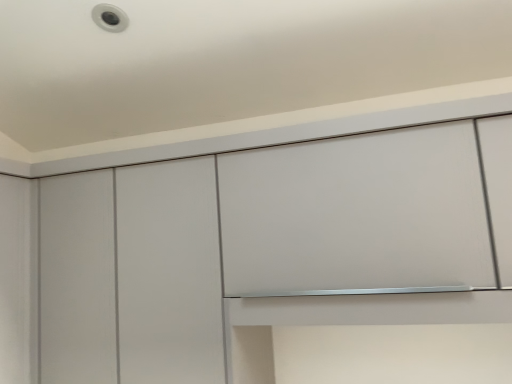
The width and height of the screenshot is (512, 384). What do you see at coordinates (273, 239) in the screenshot?
I see `matte white cabinet at upper center` at bounding box center [273, 239].

This screenshot has width=512, height=384. Find the location of `matte white cabinet at upper center`. matte white cabinet at upper center is located at coordinates (273, 239).

At what (x,y) coordinates should I click in order to perform the action: click on matte white cabinet at upper center. Please return your answer as a coordinate pair (x, y). Image resolution: width=512 pixels, height=384 pixels. Looking at the image, I should click on (273, 239).